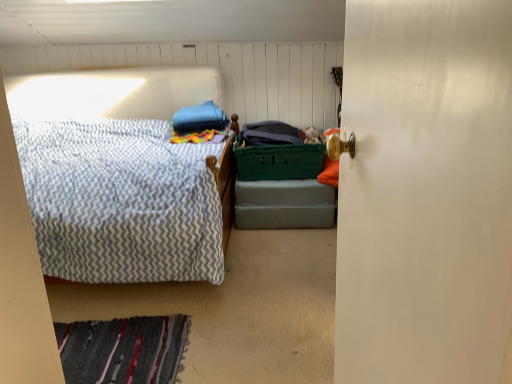
Question: Is green plastic crate at center closer to the viewer compared to white glossy door at right?

Choices:
 (A) yes
 (B) no

Answer: (B)

Question: Does green plastic crate at center have a smaller size compared to white glossy door at right?

Choices:
 (A) yes
 (B) no

Answer: (B)

Question: Is green plastic crate at center positioned with its back to white glossy door at right?

Choices:
 (A) yes
 (B) no

Answer: (B)

Question: Can you confirm if green plastic crate at center is positioned to the right of white glossy door at right?

Choices:
 (A) yes
 (B) no

Answer: (A)

Question: From a real-world perspective, is green plastic crate at center located higher than white glossy door at right?

Choices:
 (A) yes
 (B) no

Answer: (B)

Question: Is the surface of green plastic crate at center in direct contact with white glossy door at right?

Choices:
 (A) no
 (B) yes

Answer: (A)

Question: Is the surface of green plastic laundry basket at center in direct contact with green plastic crate at center?

Choices:
 (A) yes
 (B) no

Answer: (B)

Question: Can we say green plastic laundry basket at center lies outside green plastic crate at center?

Choices:
 (A) no
 (B) yes

Answer: (B)

Question: Considering the relative sizes of green plastic laundry basket at center and green plastic crate at center in the image provided, is green plastic laundry basket at center wider than green plastic crate at center?

Choices:
 (A) no
 (B) yes

Answer: (A)

Question: Can you confirm if green plastic laundry basket at center is taller than green plastic crate at center?

Choices:
 (A) no
 (B) yes

Answer: (B)

Question: Is green plastic laundry basket at center far from green plastic crate at center?

Choices:
 (A) yes
 (B) no

Answer: (B)

Question: Does green plastic laundry basket at center lie behind green plastic crate at center?

Choices:
 (A) no
 (B) yes

Answer: (A)

Question: From the image's perspective, is green plastic crate at center located above green plastic laundry basket at center?

Choices:
 (A) yes
 (B) no

Answer: (B)